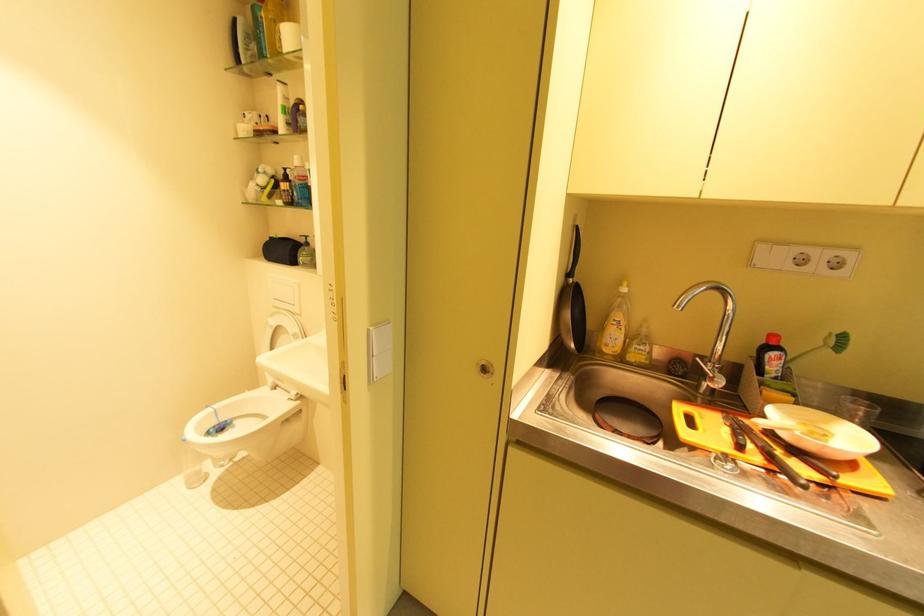
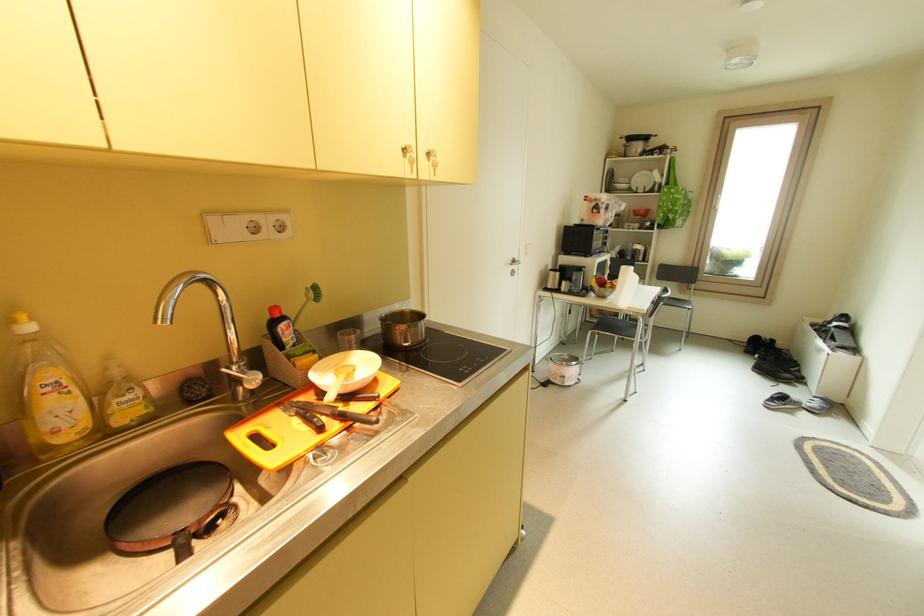
The images are taken continuously from a first-person perspective. In which direction is your viewpoint rotating?

The camera's rotation is toward right-down.